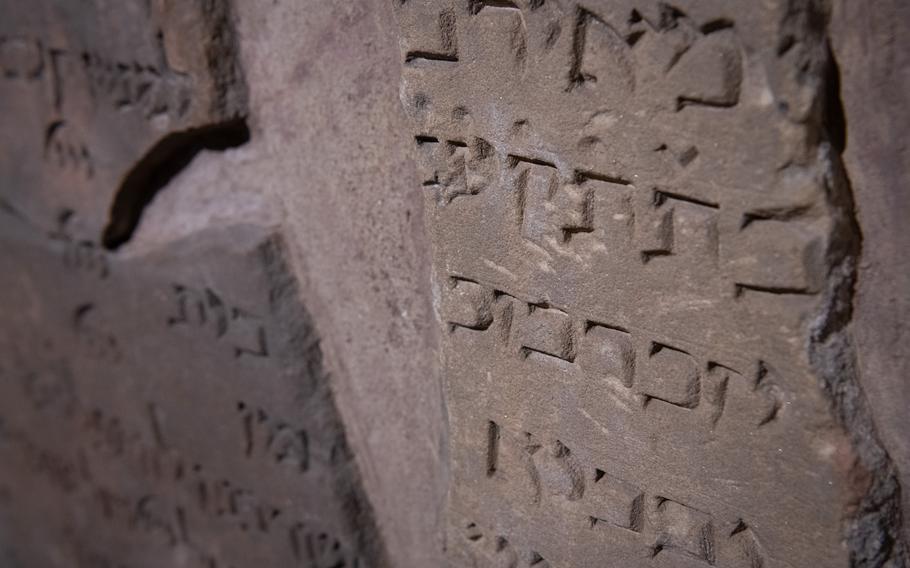
The width and height of the screenshot is (910, 568). In order to click on raised ledge in this screenshot , I will do `click(843, 383)`.